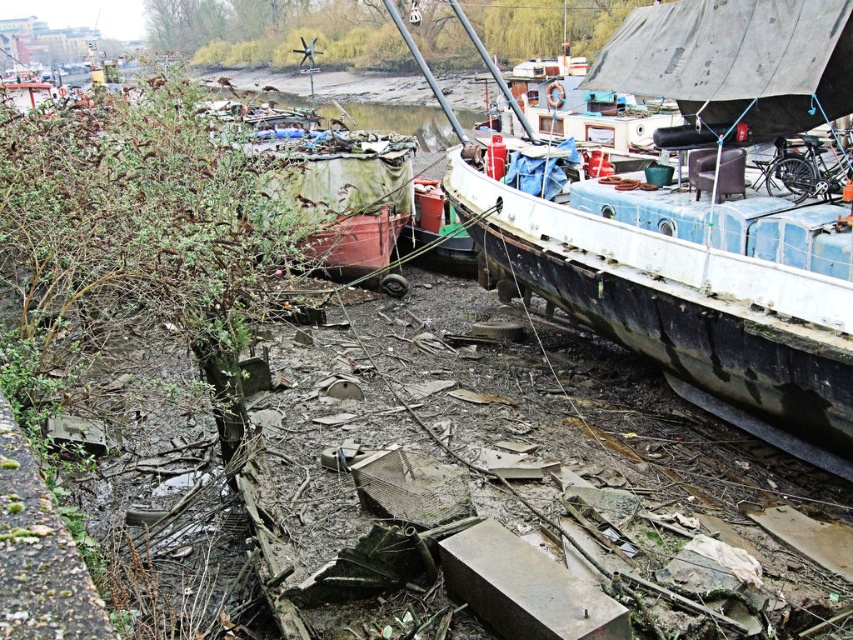
Can you confirm if blue painted wood boat at right is taller than rusty metal boat at center?

Incorrect, blue painted wood boat at right's height is not larger of rusty metal boat at center's.

Between point (805, 355) and point (332, 200), which one is positioned in front?

Point (805, 355) is in front.

Locate an element on the screen. Image resolution: width=853 pixels, height=640 pixels. blue painted wood boat at right is located at coordinates coord(706,221).